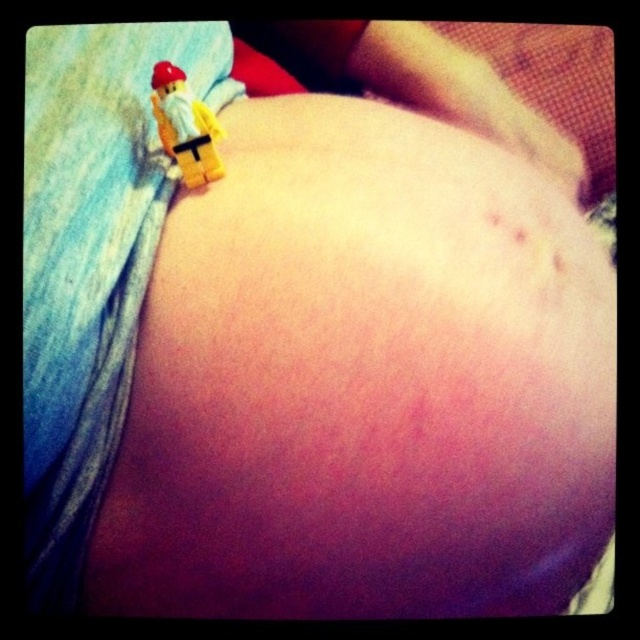
Describe the element at coordinates (419, 81) in the screenshot. This screenshot has width=640, height=640. I see `smooth skin at upper center` at that location.

Is smooth skin at upper center further to the viewer compared to yellow plastic minifigure at upper left?

Yes, it is behind yellow plastic minifigure at upper left.

Which is in front, point (561, 141) or point (179, 163)?

Positioned in front is point (179, 163).

This screenshot has width=640, height=640. Identify the location of smooth skin at upper center. (419, 81).